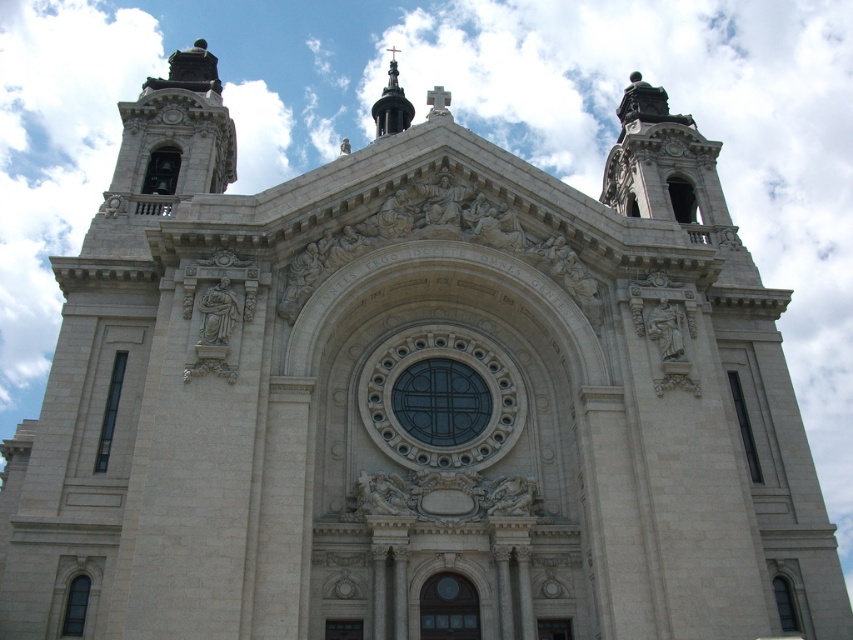
Question: Which object appears closest to the camera in this image?

Choices:
 (A) white stone clock at upper center
 (B) shiny black spire at upper center

Answer: (A)

Question: Does shiny black spire at upper center appear on the right side of white stone clock at upper center?

Choices:
 (A) no
 (B) yes

Answer: (B)

Question: Which of the following is the closest to the observer?

Choices:
 (A) white stone clock at upper center
 (B) shiny black spire at upper center

Answer: (A)

Question: Can you confirm if shiny black spire at upper center is bigger than white stone clock at upper center?

Choices:
 (A) yes
 (B) no

Answer: (A)

Question: Observing the image, what is the correct spatial positioning of shiny black spire at upper center in reference to white stone clock at upper center?

Choices:
 (A) above
 (B) below

Answer: (A)